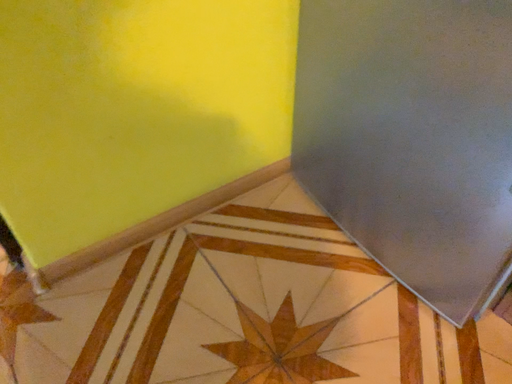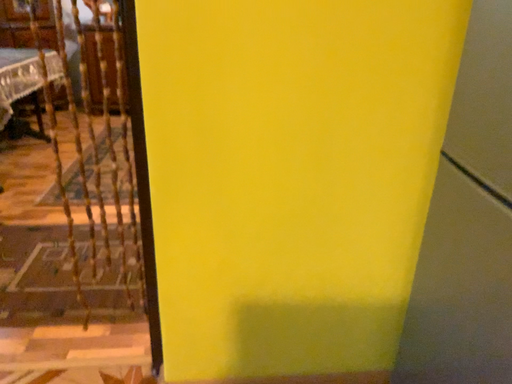
Question: Which way did the camera rotate in the video?

Choices:
 (A) rotated left
 (B) rotated right

Answer: (A)